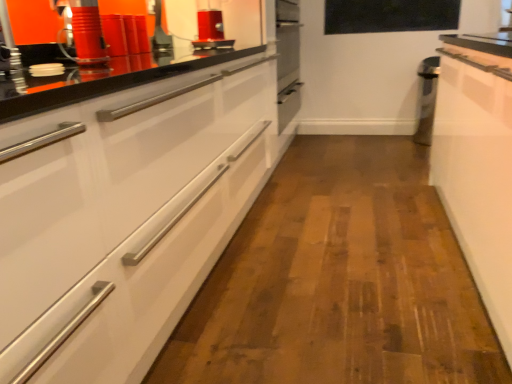
How much space does matte red canister at upper left, which ranks as the 2th appliance in right-to-left order, occupy vertically?

matte red canister at upper left, which ranks as the 2th appliance in right-to-left order, is 22.74 centimeters in height.

At what (x,y) coordinates should I click in order to perform the action: click on shiny red toaster at upper center, marked as the second appliance in a left-to-right arrangement. Please return your answer as a coordinate pair (x, y). Image resolution: width=512 pixels, height=384 pixels. Looking at the image, I should click on [211, 31].

Identify the location of matte red canister at upper left, the first appliance from the bottom. (87, 32).

From the image's perspective, is matte red canister at upper left, which is the first appliance from left to right, located above or below white glossy cabinet at left?

Based on their image positions, matte red canister at upper left, which is the first appliance from left to right, is located above white glossy cabinet at left.

From a real-world perspective, does matte red canister at upper left, which is counted as the 2th appliance, starting from the back, sit lower than white glossy cabinet at left?

No, from a real-world perspective, matte red canister at upper left, which is counted as the 2th appliance, starting from the back, is not below white glossy cabinet at left.

Can we say matte red canister at upper left, which is counted as the 2th appliance, starting from the back, lies outside white glossy cabinet at left?

matte red canister at upper left, which is counted as the 2th appliance, starting from the back, is positioned outside white glossy cabinet at left.

Based on the photo, who is bigger, matte red canister at upper left, placed as the 2th appliance when sorted from top to bottom, or white glossy cabinet at left?

white glossy cabinet at left is bigger.

Does point (381, 330) lie behind point (89, 62)?

Yes, point (381, 330) is farther from viewer.

Which object is thinner, white glossy cabinet at left or matte red canister at upper left, which is the first appliance in front-to-back order?

Thinner between the two is matte red canister at upper left, which is the first appliance in front-to-back order.

Find the location of `plain located below the matte red canister at upper left, which ranks as the 2th appliance in right-to-left order (from the image's perspective)`. plain located below the matte red canister at upper left, which ranks as the 2th appliance in right-to-left order (from the image's perspective) is located at coordinates (339, 280).

Can you confirm if white glossy cabinet at left is bigger than matte red canister at upper left, which is counted as the 2th appliance, starting from the back?

Indeed, white glossy cabinet at left has a larger size compared to matte red canister at upper left, which is counted as the 2th appliance, starting from the back.

Can you confirm if white glossy cabinet at right is taller than shiny red toaster at upper center, marked as the second appliance in a left-to-right arrangement?

Indeed, white glossy cabinet at right has a greater height compared to shiny red toaster at upper center, marked as the second appliance in a left-to-right arrangement.

From the picture: Considering the relative positions of white glossy cabinet at right and shiny red toaster at upper center, the 1th appliance viewed from the top, in the image provided, is white glossy cabinet at right to the left of shiny red toaster at upper center, the 1th appliance viewed from the top, from the viewer's perspective?

No.

Can you confirm if white glossy cabinet at right is wider than shiny red toaster at upper center, which is counted as the 2th appliance, starting from the front?

Correct, the width of white glossy cabinet at right exceeds that of shiny red toaster at upper center, which is counted as the 2th appliance, starting from the front.

Find the location of a particular element. The height and width of the screenshot is (384, 512). cabinetry below the shiny red toaster at upper center, which is counted as the 2th appliance, starting from the front (from a real-world perspective) is located at coordinates (478, 163).

From the image's perspective, is black glass window screen at upper center below matte red canister at upper left, which is the first appliance in front-to-back order?

No, from the image's perspective, black glass window screen at upper center is not below matte red canister at upper left, which is the first appliance in front-to-back order.

Which is correct: black glass window screen at upper center is inside matte red canister at upper left, which is the first appliance from left to right, or outside of it?

black glass window screen at upper center exists outside the volume of matte red canister at upper left, which is the first appliance from left to right.

In the scene shown: Can you confirm if black glass window screen at upper center is smaller than matte red canister at upper left, the first appliance from the bottom?

No.

How different are the orientations of black glass window screen at upper center and matte red canister at upper left, which ranks as the 2th appliance in right-to-left order, in degrees?

There is a 98.2-degree angle between the facing directions of black glass window screen at upper center and matte red canister at upper left, which ranks as the 2th appliance in right-to-left order.

In the scene shown: From the image's perspective, which is below, shiny red toaster at upper center, which is counted as the 2th appliance, starting from the front, or white glossy cabinet at right?

white glossy cabinet at right is shown below in the image.

In terms of size, does shiny red toaster at upper center, which is counted as the 2th appliance, starting from the front, appear bigger or smaller than white glossy cabinet at right?

shiny red toaster at upper center, which is counted as the 2th appliance, starting from the front, is smaller than white glossy cabinet at right.

At what (x,y) coordinates should I click in order to perform the action: click on cabinetry in front of the shiny red toaster at upper center, the 1th appliance viewed from the top. Please return your answer as a coordinate pair (x, y). This screenshot has height=384, width=512. Looking at the image, I should click on (478, 163).

What's the angular difference between white glossy cabinet at right and matte red canister at upper left, which is counted as the 2th appliance, starting from the back,'s facing directions?

173 degrees separate the facing orientations of white glossy cabinet at right and matte red canister at upper left, which is counted as the 2th appliance, starting from the back.

Can you see white glossy cabinet at right touching matte red canister at upper left, which is the first appliance from left to right?

No, white glossy cabinet at right is not with matte red canister at upper left, which is the first appliance from left to right.

Considering the relative positions of white glossy cabinet at right and matte red canister at upper left, the first appliance from the bottom, in the image provided, is white glossy cabinet at right to the left or to the right of matte red canister at upper left, the first appliance from the bottom,?

Based on their positions, white glossy cabinet at right is located to the right of matte red canister at upper left, the first appliance from the bottom.

Is point (455, 66) positioned before point (76, 9)?

No, (455, 66) is further to viewer.

From the image's perspective, is white glossy cabinet at right positioned above or below black glass window screen at upper center?

white glossy cabinet at right is situated lower than black glass window screen at upper center in the image.

Considering the positions of point (454, 186) and point (364, 8), is point (454, 186) closer or farther from the camera than point (364, 8)?

Point (454, 186).

How far apart are white glossy cabinet at right and black glass window screen at upper center?

white glossy cabinet at right is 1.98 meters away from black glass window screen at upper center.

From the picture: Which of these two, white glossy cabinet at right or black glass window screen at upper center, stands taller?

With more height is white glossy cabinet at right.

Identify the location of the 2nd appliance to the left of the white glossy cabinet at left, counting from the anchor's position. (87, 32).

I want to click on plain in front of the matte red canister at upper left, which is the first appliance in front-to-back order, so click(x=339, y=280).

Considering their positions, is shiny red toaster at upper center, the 1th appliance in the back-to-front sequence, positioned further to white glossy cabinet at right than matte red canister at upper left, which is the first appliance in front-to-back order?

matte red canister at upper left, which is the first appliance in front-to-back order, lies further to white glossy cabinet at right than the other object.

When comparing their distances from shiny red toaster at upper center, the 1th appliance in the back-to-front sequence, does white glossy cabinet at right or black glass window screen at upper center seem closer?

white glossy cabinet at right is positioned closer to the anchor shiny red toaster at upper center, the 1th appliance in the back-to-front sequence.

From the image, which object appears to be farther from shiny red toaster at upper center, placed as the first appliance when sorted from right to left, white glossy cabinet at left or black glass window screen at upper center?

black glass window screen at upper center.

Based on their spatial positions, is white glossy cabinet at left or shiny red toaster at upper center, placed as the first appliance when sorted from right to left, closer to white glossy cabinet at right?

The object closer to white glossy cabinet at right is white glossy cabinet at left.

Looking at this image, based on their spatial positions, is white glossy cabinet at right or matte red canister at upper left, which is the first appliance in front-to-back order, further from white glossy cabinet at left?

The object further to white glossy cabinet at left is matte red canister at upper left, which is the first appliance in front-to-back order.

Based on their spatial positions, is shiny red toaster at upper center, which is counted as the 2th appliance, starting from the front, or black glass window screen at upper center closer to matte red canister at upper left, which is counted as the 2th appliance, starting from the back?

shiny red toaster at upper center, which is counted as the 2th appliance, starting from the front.

Which object lies further to the anchor point black glass window screen at upper center, white glossy cabinet at right or white glossy cabinet at left?

white glossy cabinet at left lies further to black glass window screen at upper center than the other object.

From the image, which object appears to be farther from matte red canister at upper left, which is counted as the 2th appliance, starting from the back, white glossy cabinet at right or white glossy cabinet at left?

Among the two, white glossy cabinet at right is located further to matte red canister at upper left, which is counted as the 2th appliance, starting from the back.

The width and height of the screenshot is (512, 384). I want to click on appliance positioned between white glossy cabinet at left and shiny red toaster at upper center, the second appliance when ordered from bottom to top, from near to far, so click(x=87, y=32).

I want to click on plain between white glossy cabinet at right and black glass window screen at upper center in the front-back direction, so click(x=339, y=280).

Where is `plain located between white glossy cabinet at right and shiny red toaster at upper center, the 1th appliance viewed from the top, in the depth direction`? This screenshot has height=384, width=512. plain located between white glossy cabinet at right and shiny red toaster at upper center, the 1th appliance viewed from the top, in the depth direction is located at coordinates (339, 280).

Locate an element on the screen. This screenshot has height=384, width=512. plain located between matte red canister at upper left, which ranks as the 2th appliance in right-to-left order, and white glossy cabinet at right in the left-right direction is located at coordinates (339, 280).